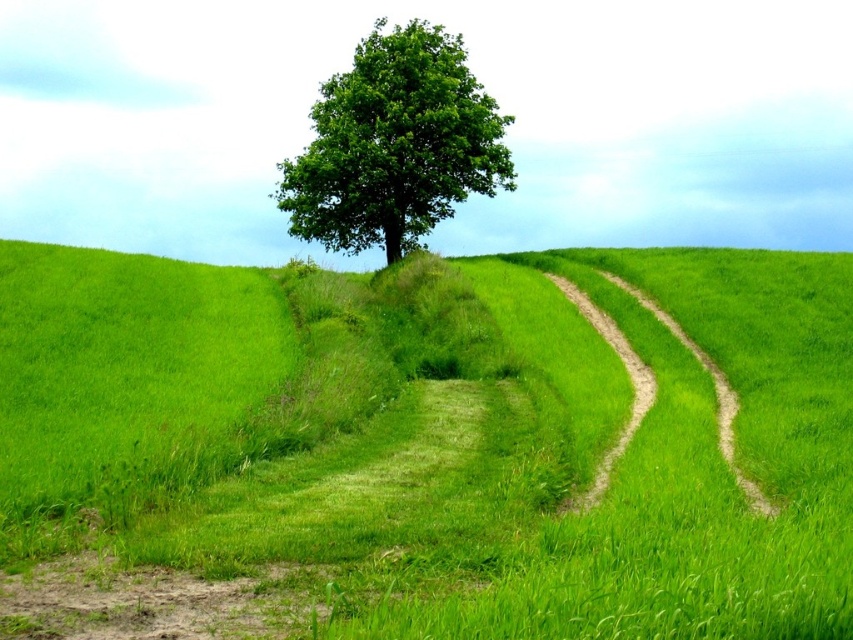
Is green grassy at center positioned in front of green leafy tree at center?

Yes, it is in front of green leafy tree at center.

What do you see at coordinates (440, 435) in the screenshot? This screenshot has height=640, width=853. I see `green grassy at center` at bounding box center [440, 435].

What do you see at coordinates (440, 435) in the screenshot? I see `green grassy at center` at bounding box center [440, 435].

Where is `green grassy at center`? The width and height of the screenshot is (853, 640). green grassy at center is located at coordinates (440, 435).